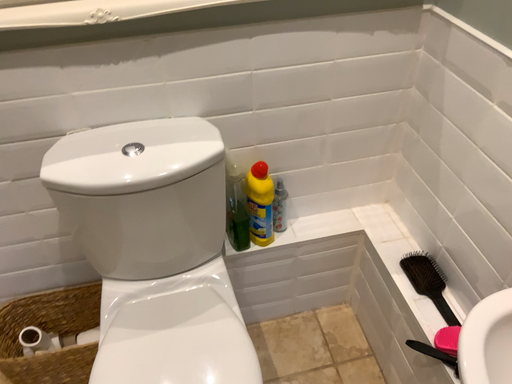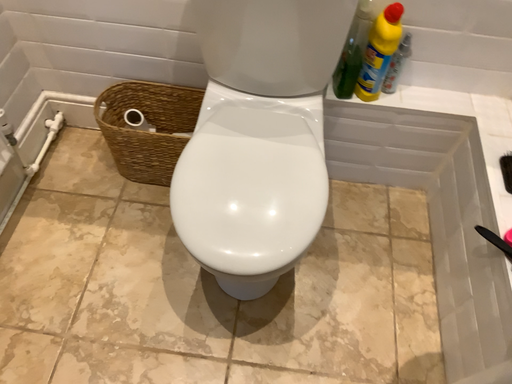
Question: Which way did the camera rotate in the video?

Choices:
 (A) rotated downward
 (B) rotated upward

Answer: (A)